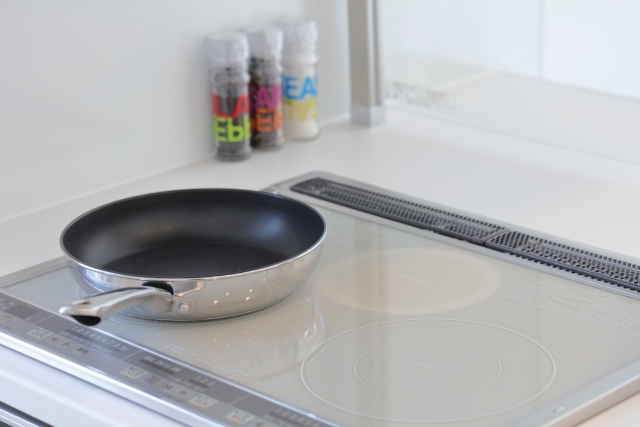
Locate an element on the screen. frying pan is located at coordinates (211, 259).